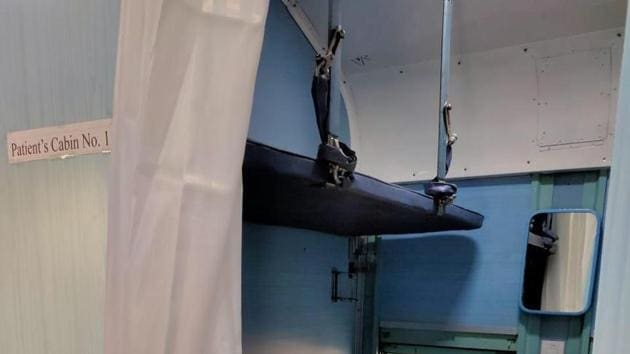
The height and width of the screenshot is (354, 630). I want to click on hanging blue bed, so click(365, 190).